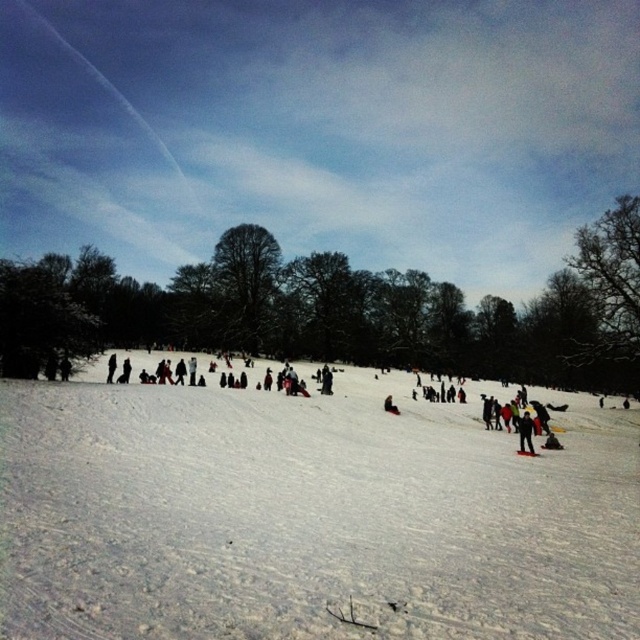
You are a photographer trying to capture a winter scene. You notice the white snow at center and the black matte jacket at lower right. Which object is taller in the image?

The white snow at center is taller than the black matte jacket at lower right.

Consider the image. You are planning to place a small decorative snowman on the white snow at center and the dark red fabric at center. Which location would allow the snowman to be more visible from a distance?

The white snow at center has a larger size compared to dark red fabric at center, so placing the snowman on the white snow at center would make it more visible from a distance because the larger area provides a better contrast and foundation.

From the picture: You are standing in the snowy landscape and want to take a photo of both the point at coordinates (388, 396) and the point at (529, 451). Which point should you focus on first to ensure both are in focus?

You should focus on the point at coordinates (388, 396) first because it is closer to the camera than the point at (529, 451). This ensures that both points will be in focus when using a camera with a fixed focal plane.